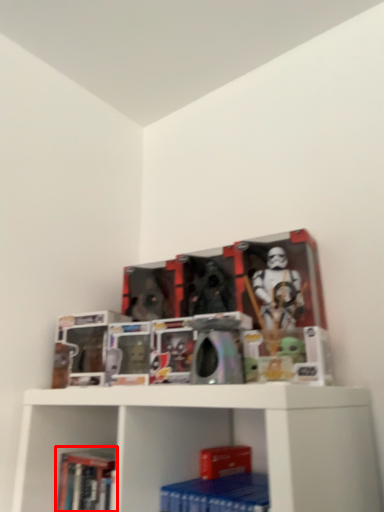
Question: From the image's perspective, what is the correct spatial positioning of book (annotated by the red box) in reference to paperback book?

Choices:
 (A) above
 (B) below

Answer: (B)